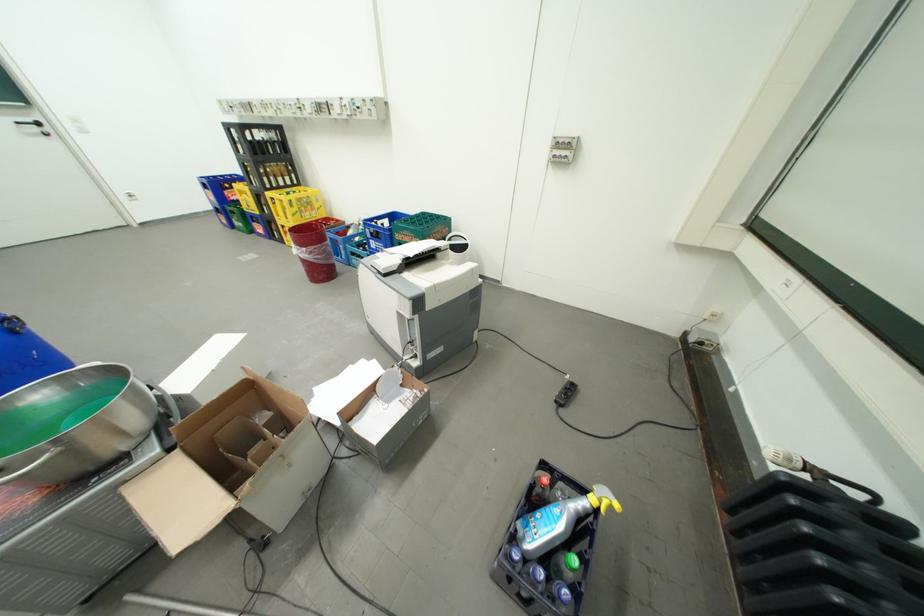
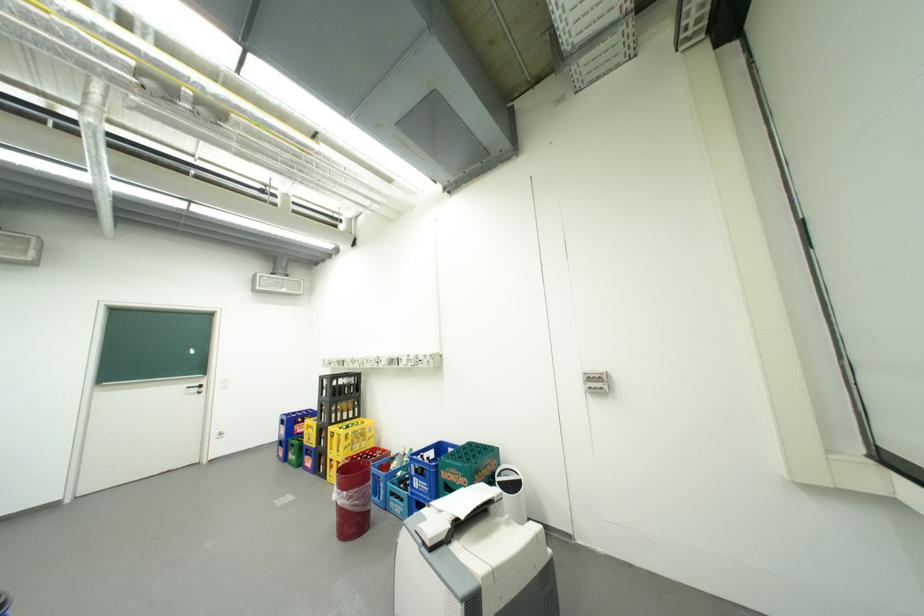
Question: How did the camera likely rotate?

Choices:
 (A) Left
 (B) Right
 (C) Up
 (D) Down

Answer: (C)